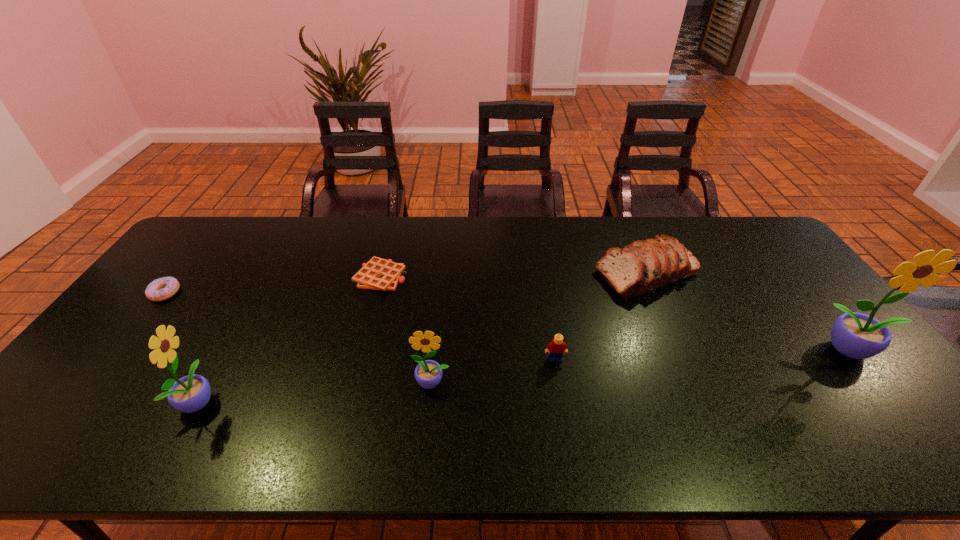
Identify which sunflower is located as the second nearest to the tallest object. Please provide its 2D coordinates. Your answer should be formatted as a tuple, i.e. [(x, y)], where the tuple contains the x and y coordinates of a point satisfying the conditions above.

[(191, 393)]

The height and width of the screenshot is (540, 960). I want to click on vacant position in the image that satisfies the following two spatial constraints: 1. on the front-facing side of the farthest sunflower; 2. on the front-facing side of the second object from left to right, so click(893, 401).

At what (x,y) coordinates should I click in order to perform the action: click on vacant space that satisfies the following two spatial constraints: 1. on the front-facing side of the third object from right to left; 2. on the front-facing side of the sixth object from right to left. Please return your answer as a coordinate pair (x, y). Image resolution: width=960 pixels, height=540 pixels. Looking at the image, I should click on (562, 401).

The width and height of the screenshot is (960, 540). I want to click on blank space that satisfies the following two spatial constraints: 1. on the front side of the fourth tallest object; 2. on the front-facing side of the second tallest object, so click(703, 401).